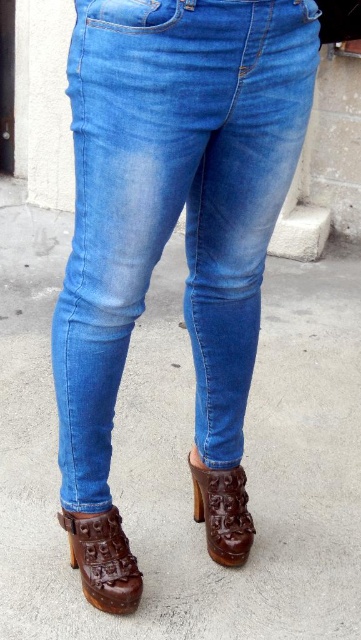
From the picture: You are standing in front of a full length mirror trying to adjust your outfit. You notice the denim jeans at center and the brown leather shoe at lower left. Which item is positioned more to the left side?

The brown leather shoe at lower left is positioned more to the left side compared to the denim jeans at center.

You are taking a photo of the jeans and boots shown in the image. You want to focus on the point closer to the camera. Which point should you choose between point (x=106, y=355) and point (x=244, y=500)?

Point (x=106, y=355) is closer to the camera than point (x=244, y=500), so you should focus on point (x=106, y=355).

You are a tailor measuring clothing items. You have a denim jeans at center and a brown leather shoe at lower left in front of you. Which item is larger in size?

The denim jeans at center is bigger than the brown leather shoe at lower left.